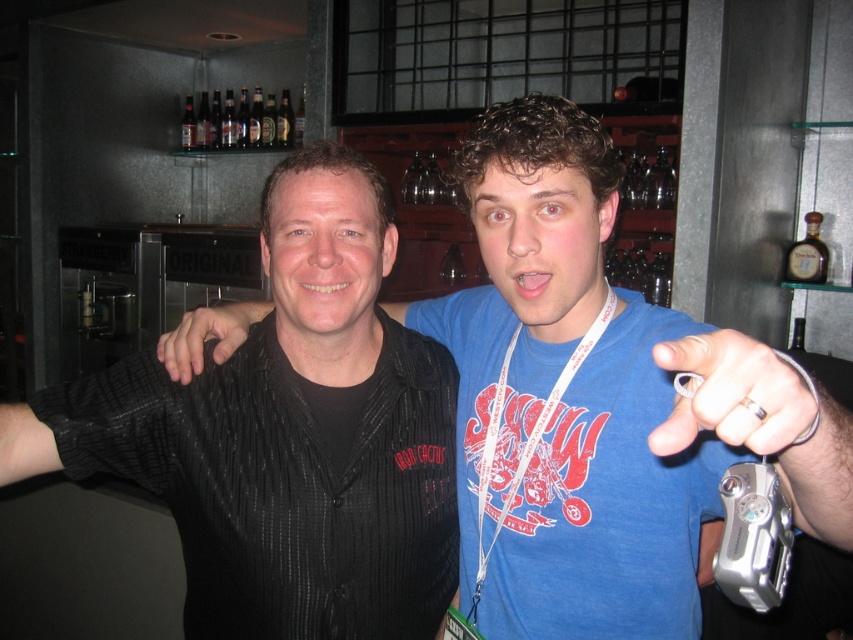
You are a photographer at the event and want to capture a closeup shot of the silver metallic ring at right and the black matte hand at center. The camera you are using has a maximum focus range of 70 centimeters. Will you be able to focus on both objects simultaneously?

The silver metallic ring at right is 73.31 centimeters away from the black matte hand at center. Since the camera can only focus up to 70 centimeters, the distance between them exceeds the maximum focus range. Therefore, you cannot focus on both objects simultaneously.